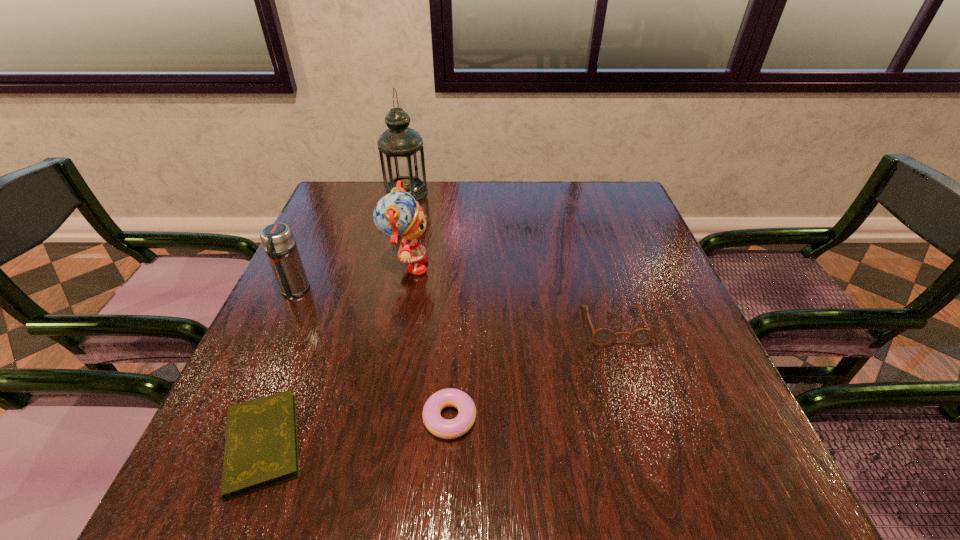
Where is `free space between the tallest object and the third nearest object`? The width and height of the screenshot is (960, 540). free space between the tallest object and the third nearest object is located at coordinates [x=510, y=259].

Find the location of `empty space between the farthest object and the doughnut`. empty space between the farthest object and the doughnut is located at coordinates (428, 305).

You are a GUI agent. You are given a task and a screenshot of the screen. Output one action in this format:
    pyautogui.click(x=<x>, y=<y>)
    Task: Click on the vacant area that lies between the oil lamp and the thermos bottle
    
    Given the screenshot: What is the action you would take?
    pyautogui.click(x=350, y=242)

Where is `free space between the second tallest object and the fourth tallest object`? The height and width of the screenshot is (540, 960). free space between the second tallest object and the fourth tallest object is located at coordinates (510, 297).

I want to click on vacant region between the fifth tallest object and the farthest object, so click(x=428, y=305).

Find the location of a particular element. The height and width of the screenshot is (540, 960). free space that is in between the oil lamp and the second object from right to left is located at coordinates (428, 305).

Where is `empty space that is in between the rightmost object and the thermos bottle`? The width and height of the screenshot is (960, 540). empty space that is in between the rightmost object and the thermos bottle is located at coordinates (454, 308).

This screenshot has width=960, height=540. Find the location of `the fourth closest object to the doll`. the fourth closest object to the doll is located at coordinates (261, 444).

Locate which object is the third closest to the farthest object. Please provide its 2D coordinates. Your answer should be formatted as a tuple, i.e. [(x, y)], where the tuple contains the x and y coordinates of a point satisfying the conditions above.

[(602, 337)]

Identify the location of free space that satisfies the following two spatial constraints: 1. on the face of the second tallest object; 2. with a handle on the side of the fourth shortest object. (402, 291).